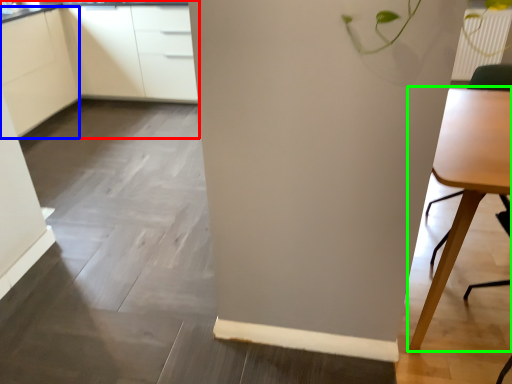
Question: Which is farther away from cabinetry (highlighted by a red box)? cabinetry (highlighted by a blue box) or table (highlighted by a green box)?

Choices:
 (A) cabinetry
 (B) table

Answer: (B)